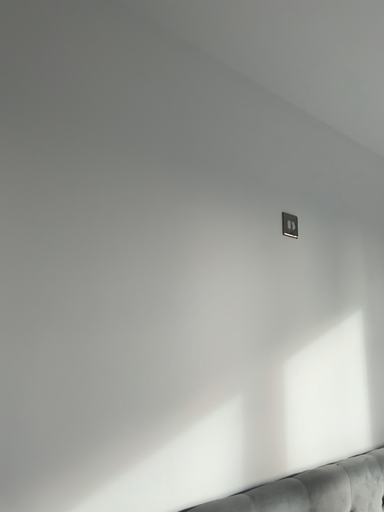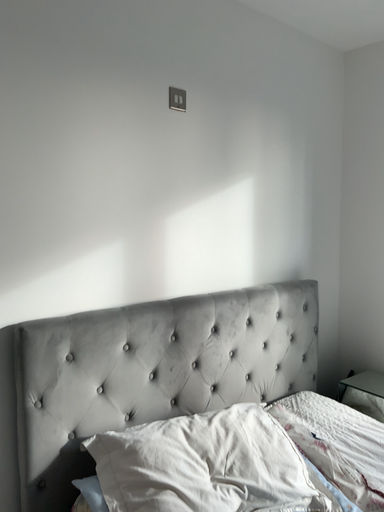
Question: Which way did the camera rotate in the video?

Choices:
 (A) rotated downward
 (B) rotated upward

Answer: (A)